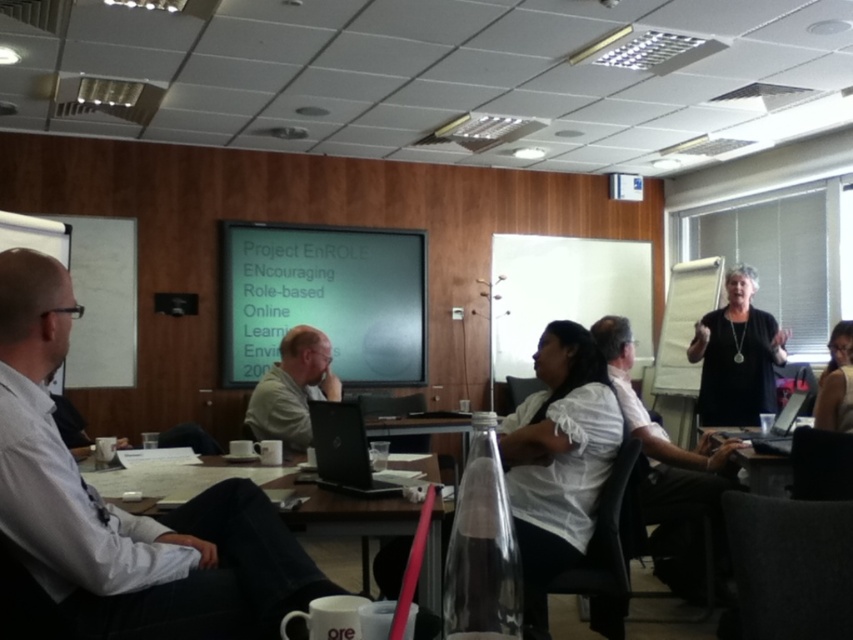
Question: Which of these objects is positioned closest to the black fabric at center?

Choices:
 (A) gray fabric shirt at center
 (B) matte projector screen at center
 (C) white shirt at left
 (D) white shirt at center

Answer: (D)

Question: Is the position of white shirt at center more distant than that of black matte laptop at center?

Choices:
 (A) no
 (B) yes

Answer: (B)

Question: Is black matte laptop at center positioned before black glossy laptop at lower right?

Choices:
 (A) no
 (B) yes

Answer: (B)

Question: Which of the following is the farthest from the observer?

Choices:
 (A) wooden table at center
 (B) black glossy laptop at lower right
 (C) clear plastic bottle at lower center

Answer: (B)

Question: Which of the following is the closest to the observer?

Choices:
 (A) white fabric shirt at upper right
 (B) black fabric at center
 (C) matte projector screen at center
 (D) white shirt at left

Answer: (D)

Question: Does matte projector screen at center lie in front of white shirt at center?

Choices:
 (A) no
 (B) yes

Answer: (A)